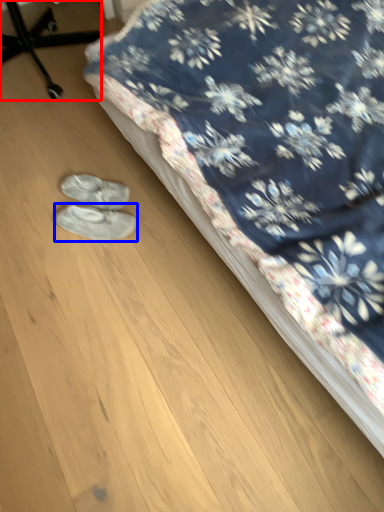
Question: Which of the following is the farthest to the observer, furniture (highlighted by a red box) or footwear (highlighted by a blue box)?

Choices:
 (A) furniture
 (B) footwear

Answer: (A)